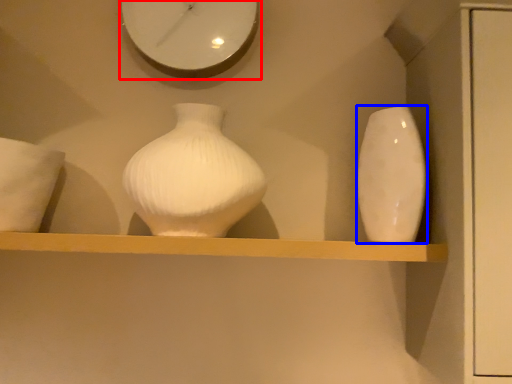
Question: Which object is further to the camera taking this photo, clock (highlighted by a red box) or vase (highlighted by a blue box)?

Choices:
 (A) clock
 (B) vase

Answer: (A)